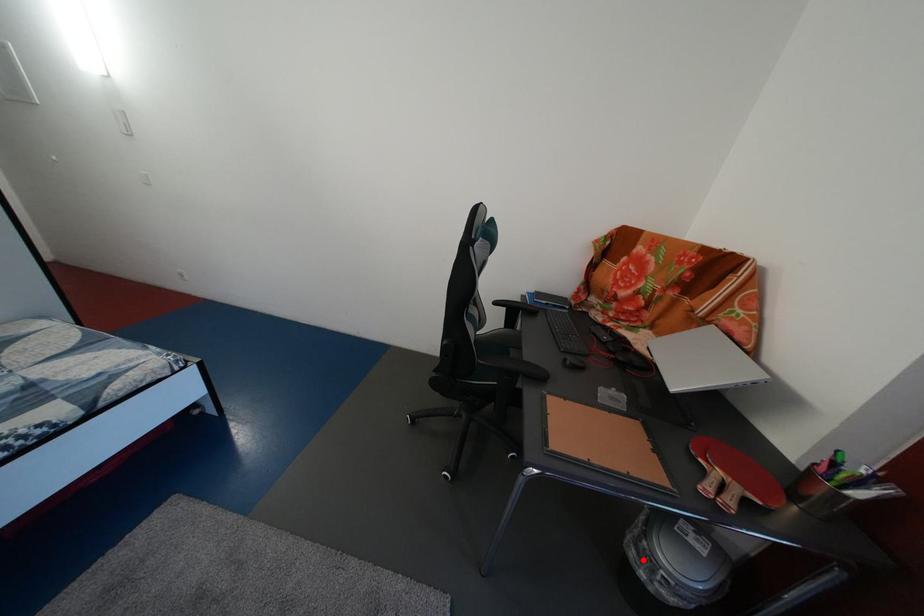
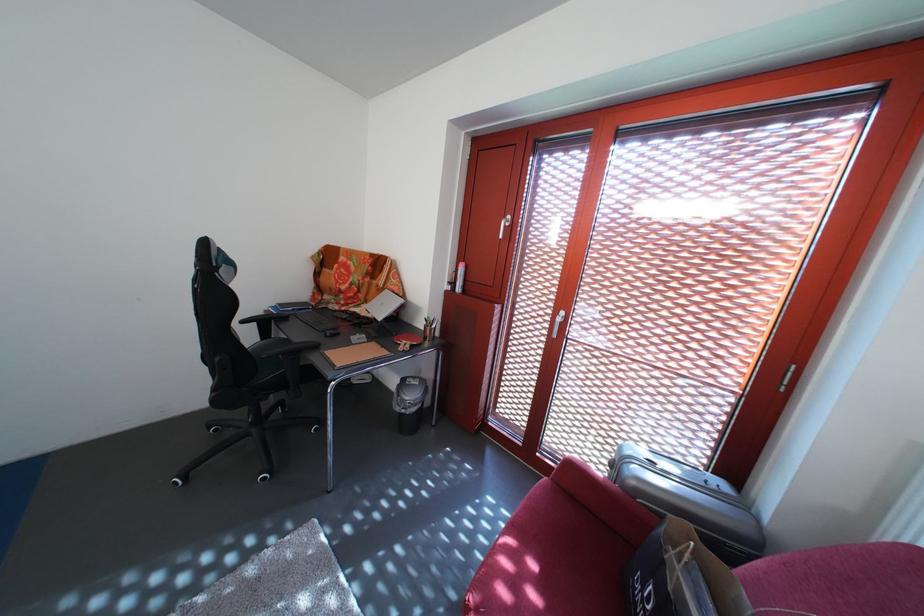
Question: I am providing you with two images of the same scene from different viewpoints. Given a red point in image1, look at the same physical point in image2. Is it:

Choices:
 (A) Closer to the viewpoint
 (B) Farther from the viewpoint

Answer: (B)